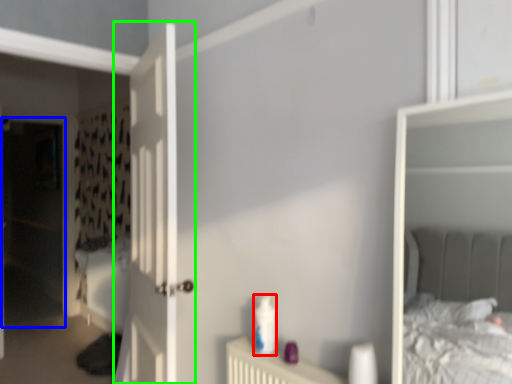
Question: Considering the real-world distances, which object is closest to toiletry (highlighted by a red box)? screen door (highlighted by a blue box) or door (highlighted by a green box).

Choices:
 (A) screen door
 (B) door

Answer: (B)